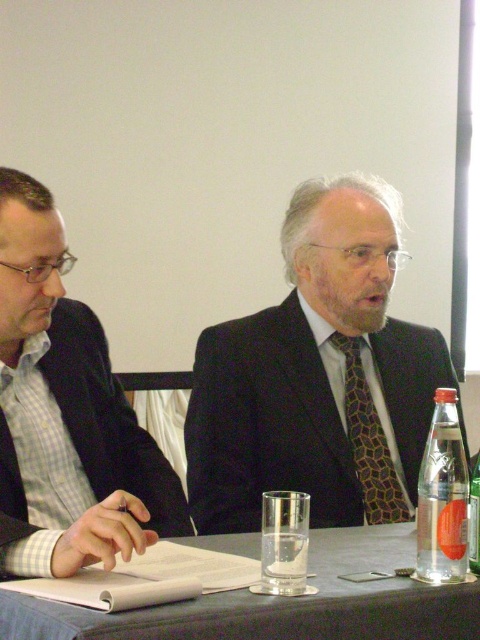
Does dark gray suit at center appear on the right side of smooth gray table at center?

Indeed, dark gray suit at center is positioned on the right side of smooth gray table at center.

Is dark gray suit at center wider than smooth gray table at center?

In fact, dark gray suit at center might be narrower than smooth gray table at center.

Where is `dark gray suit at center`? dark gray suit at center is located at coordinates (266, 422).

The image size is (480, 640). In order to click on dark gray suit at center in this screenshot , I will do `click(266, 422)`.

This screenshot has height=640, width=480. I want to click on smooth gray table at center, so click(282, 604).

Who is higher up, smooth gray table at center or brown textured tie at center?

brown textured tie at center is above.

Is point (432, 602) closer to camera compared to point (359, 358)?

That is True.

You are a GUI agent. You are given a task and a screenshot of the screen. Output one action in this format:
    pyautogui.click(x=<x>, y=<y>)
    Task: Click on the smooth gray table at center
    Image resolution: width=480 pixels, height=640 pixels.
    Given the screenshot: What is the action you would take?
    pyautogui.click(x=282, y=604)

Can you confirm if dark gray suit at center is positioned to the right of brown textured tie at center?

Incorrect, dark gray suit at center is not on the right side of brown textured tie at center.

Locate an element on the screen. dark gray suit at center is located at coordinates (266, 422).